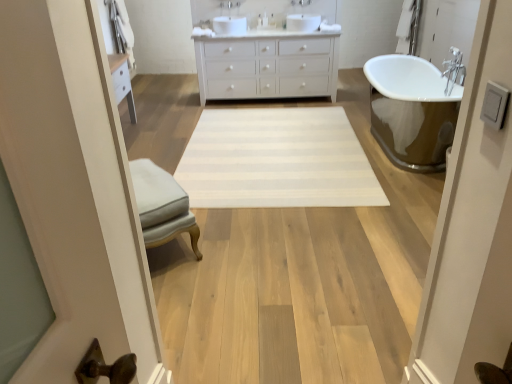
Question: Is white striped rug at center to the left of light gray fabric ottoman at center from the viewer's perspective?

Choices:
 (A) yes
 (B) no

Answer: (B)

Question: Can you confirm if white striped rug at center is wider than light gray fabric ottoman at center?

Choices:
 (A) yes
 (B) no

Answer: (A)

Question: Is white striped rug at center shorter than light gray fabric ottoman at center?

Choices:
 (A) yes
 (B) no

Answer: (A)

Question: Are white striped rug at center and light gray fabric ottoman at center far apart?

Choices:
 (A) yes
 (B) no

Answer: (A)

Question: Is the depth of white striped rug at center less than that of light gray fabric ottoman at center?

Choices:
 (A) yes
 (B) no

Answer: (B)

Question: Are white striped rug at center and light gray fabric ottoman at center making contact?

Choices:
 (A) no
 (B) yes

Answer: (A)

Question: From a real-world perspective, is white matte cabinet at center positioned under white striped rug at center based on gravity?

Choices:
 (A) yes
 (B) no

Answer: (B)

Question: From the image's perspective, does white matte cabinet at center appear lower than white striped rug at center?

Choices:
 (A) yes
 (B) no

Answer: (B)

Question: Is white matte cabinet at center positioned with its back to white striped rug at center?

Choices:
 (A) yes
 (B) no

Answer: (B)

Question: Can you confirm if white matte cabinet at center is taller than white striped rug at center?

Choices:
 (A) yes
 (B) no

Answer: (A)

Question: From the image's perspective, does white matte cabinet at center appear higher than white striped rug at center?

Choices:
 (A) no
 (B) yes

Answer: (B)

Question: Does white matte cabinet at center appear on the left side of white striped rug at center?

Choices:
 (A) no
 (B) yes

Answer: (A)

Question: Would you say light gray fabric ottoman at center contains white striped rug at center?

Choices:
 (A) no
 (B) yes

Answer: (A)